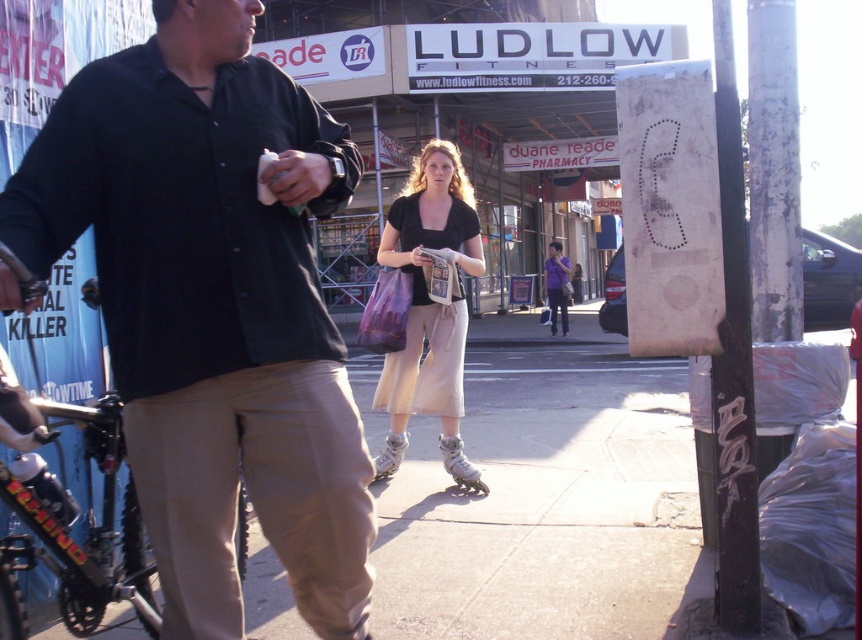
Based on the photo, can you confirm if black matte shirt at center is thinner than black painted metal pole at right?

In fact, black matte shirt at center might be wider than black painted metal pole at right.

Who is shorter, black matte shirt at center or black painted metal pole at right?

With less height is black matte shirt at center.

Is point (57, 220) positioned behind point (734, 538)?

No.

Identify the location of black matte shirt at center. The height and width of the screenshot is (640, 862). (211, 310).

Is matte black hand at center to the right of matte black handbag at center from the viewer's perspective?

In fact, matte black hand at center is to the left of matte black handbag at center.

Does matte black hand at center come behind matte black handbag at center?

No, matte black hand at center is closer to the viewer.

Does point (286, 156) lie behind point (417, 250)?

No.

Identify the location of matte black hand at center. (297, 177).

Is light brown concrete sidewalk at center to the right of matte black hand at center from the viewer's perspective?

Yes, light brown concrete sidewalk at center is to the right of matte black hand at center.

Find the location of a particular element. Image resolution: width=862 pixels, height=640 pixels. light brown concrete sidewalk at center is located at coordinates (547, 497).

Where is `light brown concrete sidewalk at center`? light brown concrete sidewalk at center is located at coordinates (547, 497).